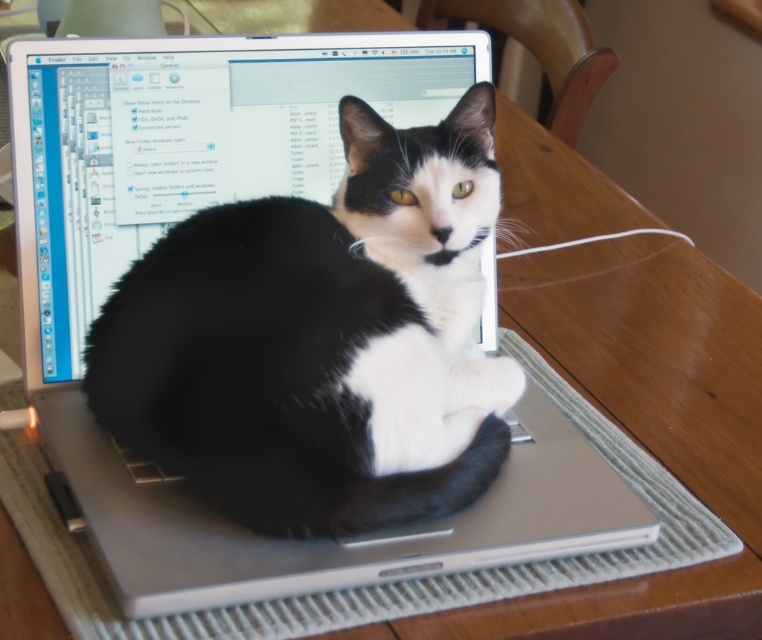
Question: Can you confirm if black fur cat at center is smaller than white string at upper right?

Choices:
 (A) no
 (B) yes

Answer: (A)

Question: Does black fur cat at center have a smaller size compared to white string at upper right?

Choices:
 (A) yes
 (B) no

Answer: (B)

Question: Is black fur cat at center thinner than white string at upper right?

Choices:
 (A) no
 (B) yes

Answer: (A)

Question: Which object is closer to the camera taking this photo?

Choices:
 (A) white string at upper right
 (B) black fur cat at center

Answer: (B)

Question: Which point is closer to the camera?

Choices:
 (A) white string at upper right
 (B) black fur cat at center

Answer: (B)